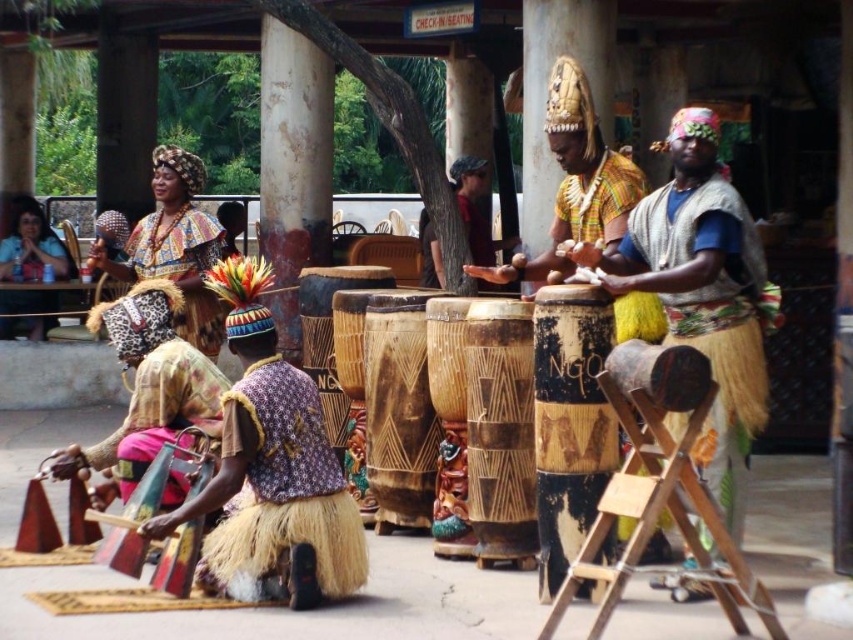
You are a photographer trying to capture a clear shot of both the knitted beige vest at center and the natural wood drum at center. Since you want to ensure both are in focus, you need to know which object is bigger. Which one is larger?

The knitted beige vest at center is larger in size than the natural wood drum at center, so you should focus on the knitted beige vest at center first as it takes up more space in the frame.

You are standing at the camera position and want to hand a gift to the performer wearing the knitted beige vest at center. The gift is 1 foot in length. Can you reach them without moving from your current position?

The knitted beige vest at center is 17.65 feet away from the camera, so you cannot reach them with a gift that is only 1 foot long without moving from your current position.

You are a photographer trying to capture the performer wearing the knitted beige vest at center and the natural wood drum at center. Since the vest is covering part of the drum, how should you adjust your shot to ensure both are fully visible?

The knitted beige vest at center is positioned over natural wood drum at center. To ensure both are fully visible, you should adjust your angle to capture the drum from below the vest or move the vest slightly if possible.